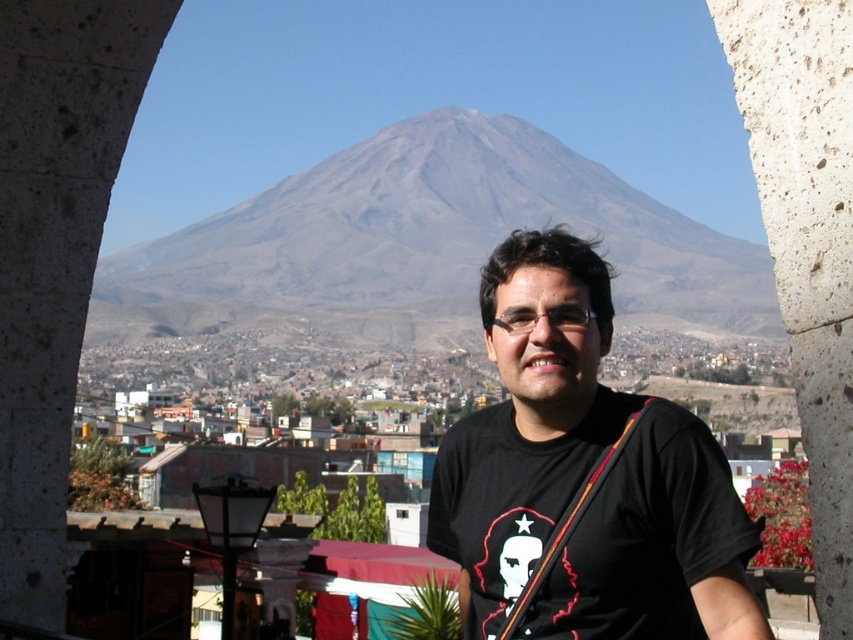
You are a photographer trying to capture the mountain view. You notice the black matte shirt at center and the gray stone pillar at right in your frame. Which object is positioned lower in the image?

The black matte shirt at center is located below the gray stone pillar at right, so it is positioned lower in the image.